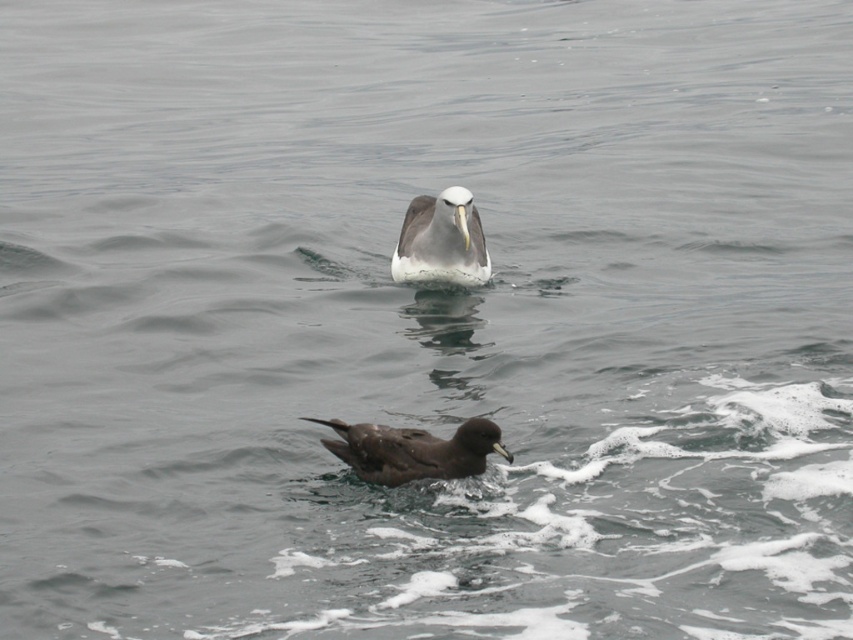
You are observing two points in the image of the seabirds. Which point, point (402,454) or point (477,262), is nearer to you?

Point (402,454) is closer to the camera than point (477,262).

You are a marine biologist observing two seabirds in the ocean. You notice the dark brown feathers at lower center and the white glossy bird at center. Which bird has a smaller height?

The dark brown feathers at lower center is shorter than the white glossy bird at center, so the dark brown feathers at lower center has a smaller height.